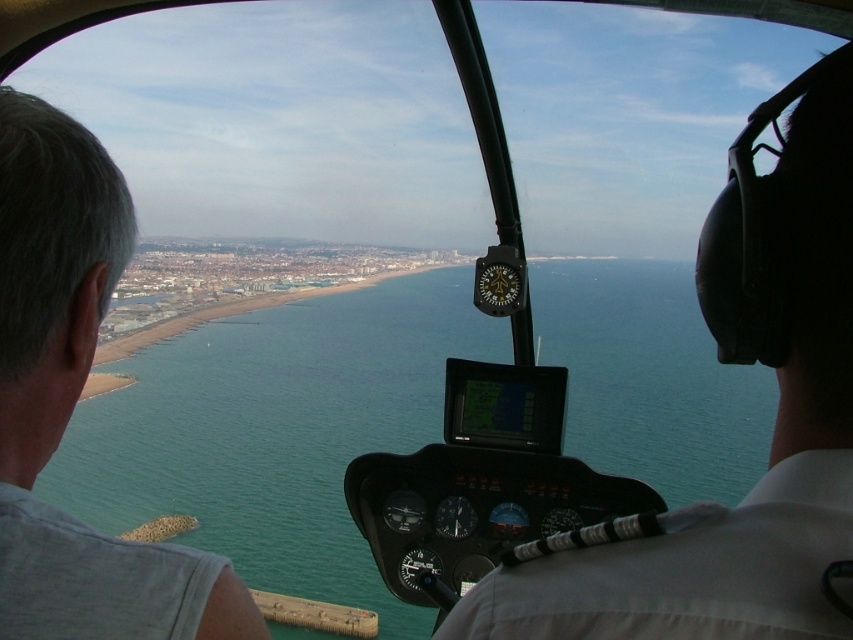
Which is more to the right, white fabric at upper right or gray hair at left?

Positioned to the right is white fabric at upper right.

Can you confirm if white fabric at upper right is bigger than gray hair at left?

No.

Describe the element at coordinates (772, 435) in the screenshot. I see `white fabric at upper right` at that location.

I want to click on white fabric at upper right, so click(772, 435).